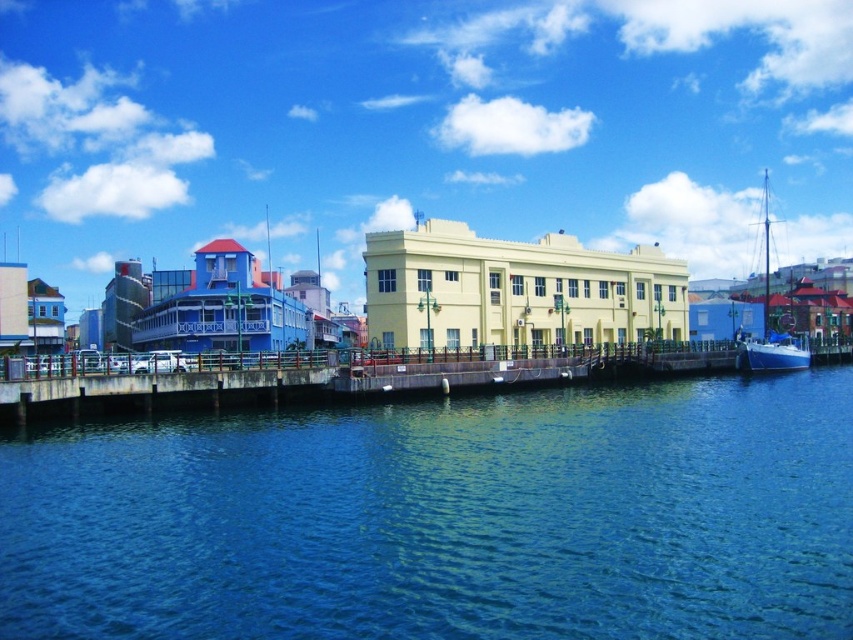
You are a tour guide leading a group along the wooden pier. You want to point out both the blue water at lower center and the blue matte sailboat at right to your group. Which one is farther away from the pier?

The blue matte sailboat at right is farther away from the pier than the blue water at lower center because the distance between them is 208.82 feet.

You are a photographer standing on the wooden pier and want to capture both the blue water at lower center and the blue matte sailboat at right in your shot. Which object will appear taller in the photograph?

The blue matte sailboat at right will appear taller in the photograph because the blue water at lower center is not as tall as it.